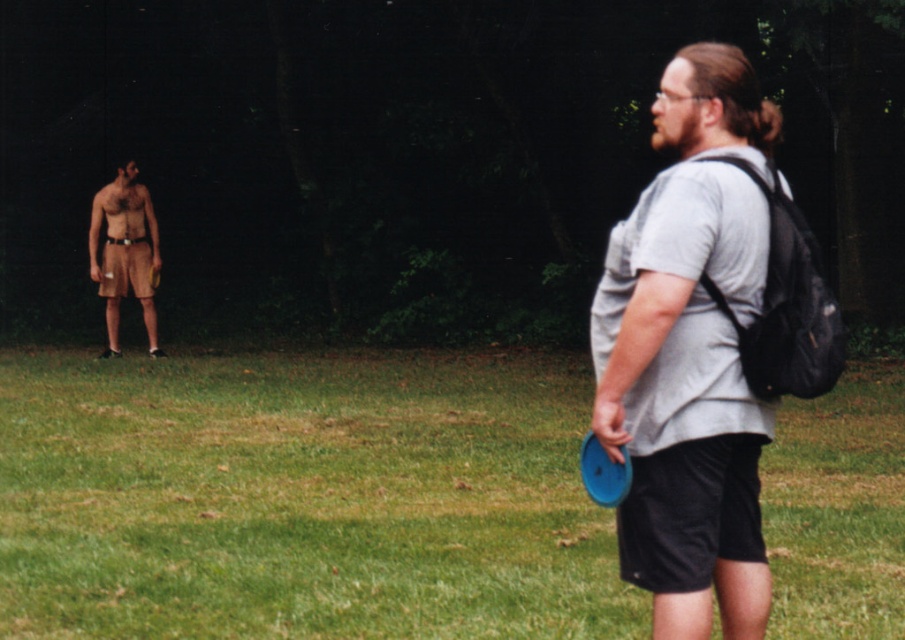
Question: Estimate the real-world distances between objects in this image. Which object is closer to the green grass at center?

Choices:
 (A) blue plastic frisbee at right
 (B) brown fabric shorts at left

Answer: (B)

Question: Which point is farther to the camera?

Choices:
 (A) (584, 452)
 (B) (373, 608)
 (C) (667, 211)
 (D) (134, 248)

Answer: (D)

Question: Is brown fabric shorts at left further to camera compared to blue plastic frisbee at right?

Choices:
 (A) no
 (B) yes

Answer: (B)

Question: Considering the relative positions of green grass at center and blue plastic frisbee at right in the image provided, where is green grass at center located with respect to blue plastic frisbee at right?

Choices:
 (A) right
 (B) left

Answer: (A)

Question: Does brown fabric shorts at left have a smaller size compared to blue plastic frisbee at right?

Choices:
 (A) yes
 (B) no

Answer: (B)

Question: Among these points, which one is nearest to the camera?

Choices:
 (A) (618, 496)
 (B) (122, 186)

Answer: (A)